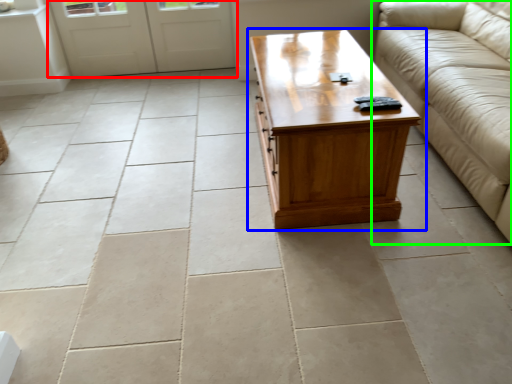
Question: Considering the real-world distances, which object is closest to door (highlighted by a red box)? coffee table (highlighted by a blue box) or studio couch (highlighted by a green box).

Choices:
 (A) coffee table
 (B) studio couch

Answer: (A)